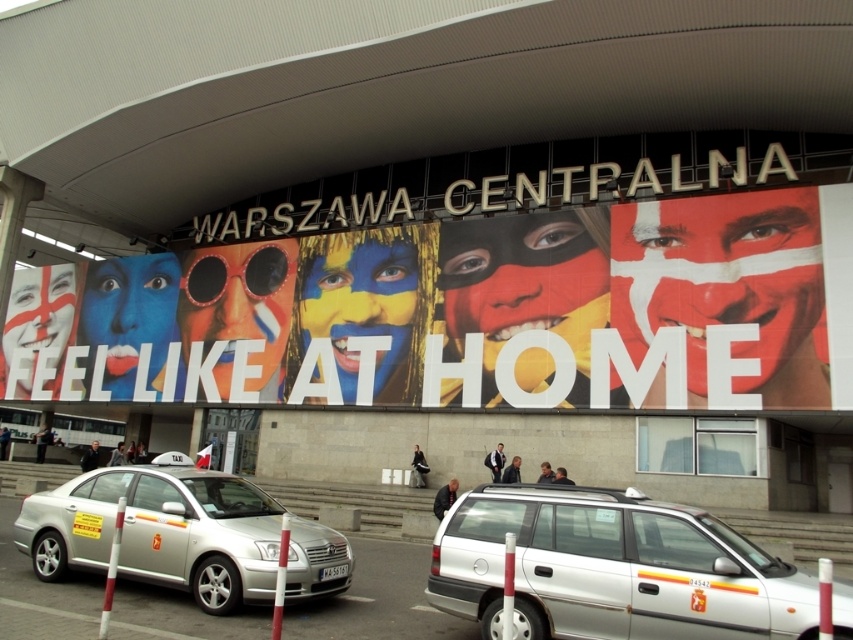
You are standing in front of Warszawa Centralna railway station. You see a point marked at coordinates (468, 310). According to the image, what does this point represent?

The point at coordinates (468, 310) marks the multicolored painted faces at center.

In the scene shown: You are a traveler standing at the entrance of Warszawa Centralna railway station. You notice the multicolored painted faces at center and the silver metallic taxi at lower left. Which object appears taller from your perspective?

The multicolored painted faces at center appears taller than the silver metallic taxi at lower left.

You are a passenger at Warszawa Centralna railway station and want to take a ride to the city center. You see a silver metallic station wagon at center and a silver metallic taxi at lower left. Which vehicle is closer to the station entrance?

The silver metallic station wagon at center is positioned under the silver metallic taxi at lower left, meaning it is closer to the station entrance than the taxi.